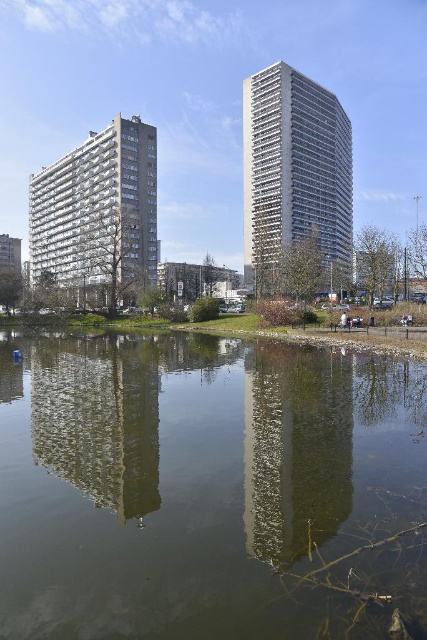
Can you confirm if green reflective water at center is positioned below white textured building at center?

Yes, green reflective water at center is below white textured building at center.

Which is behind, point (143, 518) or point (348, 264)?

Point (348, 264)

Where is `green reflective water at center`? The width and height of the screenshot is (427, 640). green reflective water at center is located at coordinates (208, 490).

Is white textured building at center in front of white textured building at left?

Yes.

Between point (271, 170) and point (111, 234), which one is positioned behind?

The point (271, 170) is behind.

Is point (271, 256) positioned after point (152, 209)?

No, (271, 256) is in front of (152, 209).

Locate an element on the screen. white textured building at center is located at coordinates (295, 173).

In the scene shown: Between green reflective water at center and white textured building at left, which one is positioned higher?

Positioned higher is white textured building at left.

Which is in front, point (11, 570) or point (60, 234)?

Point (11, 570) is more forward.

The height and width of the screenshot is (640, 427). I want to click on green reflective water at center, so click(208, 490).